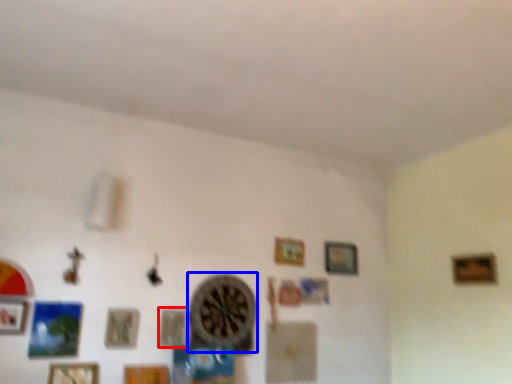
Question: Among these objects, which one is nearest to the camera, picture frame (highlighted by a red box) or clock (highlighted by a blue box)?

Choices:
 (A) picture frame
 (B) clock

Answer: (A)